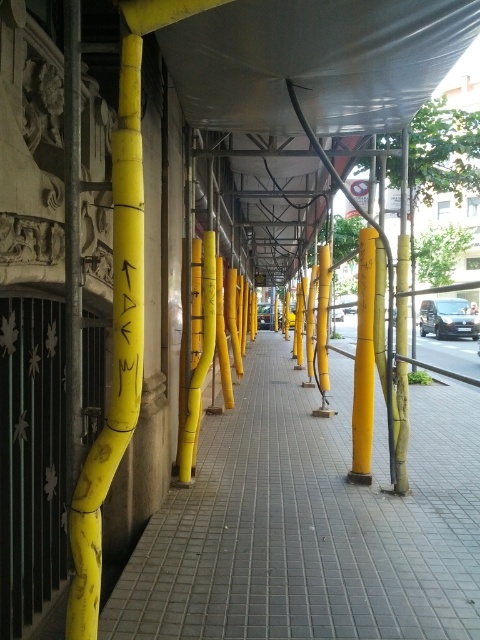
Can you confirm if gray tile pavement at center is wider than yellow matte pole at center?

Indeed, gray tile pavement at center has a greater width compared to yellow matte pole at center.

At what (x,y) coordinates should I click in order to perform the action: click on gray tile pavement at center. Please return your answer as a coordinate pair (x, y). This screenshot has height=640, width=480. Looking at the image, I should click on (311, 524).

The width and height of the screenshot is (480, 640). I want to click on gray tile pavement at center, so click(x=311, y=524).

Consider the image. Can you confirm if yellow matte pole at center is wider than black painted writing at center?

Incorrect, yellow matte pole at center's width does not surpass black painted writing at center's.

Is yellow matte pole at center behind black painted writing at center?

That is True.

Locate an element on the screen. This screenshot has height=640, width=480. yellow matte pole at center is located at coordinates (363, 362).

At what (x,y) coordinates should I click in order to perform the action: click on yellow matte pole at center. Please return your answer as a coordinate pair (x, y). Looking at the image, I should click on (363, 362).

Does gray tile pavement at center have a lesser height compared to black painted writing at center?

Yes.

Does gray tile pavement at center have a smaller size compared to black painted writing at center?

No, gray tile pavement at center is not smaller than black painted writing at center.

Measure the distance between gray tile pavement at center and camera.

They are 10.18 feet apart.

Where is `gray tile pavement at center`? The height and width of the screenshot is (640, 480). gray tile pavement at center is located at coordinates (311, 524).